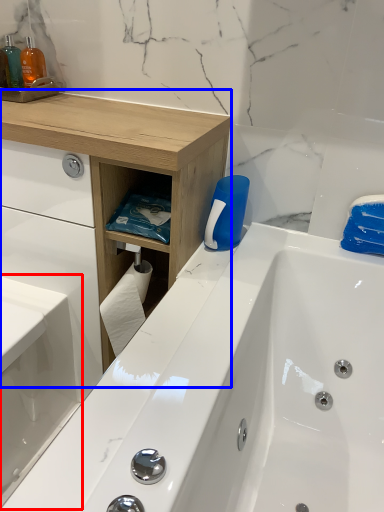
Question: Among these objects, which one is nearest to the camera, sink (highlighted by a red box) or counter (highlighted by a blue box)?

Choices:
 (A) sink
 (B) counter

Answer: (A)